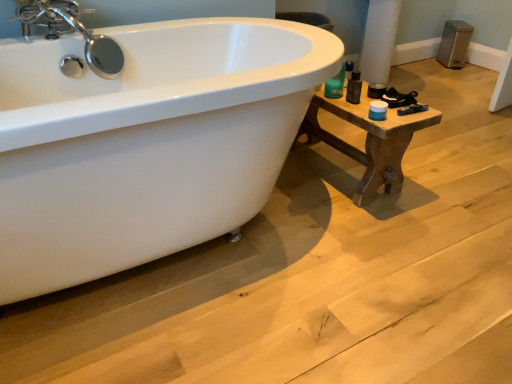
Locate an element on the screen. The width and height of the screenshot is (512, 384). free location to the right of brown wooden table at right is located at coordinates (452, 172).